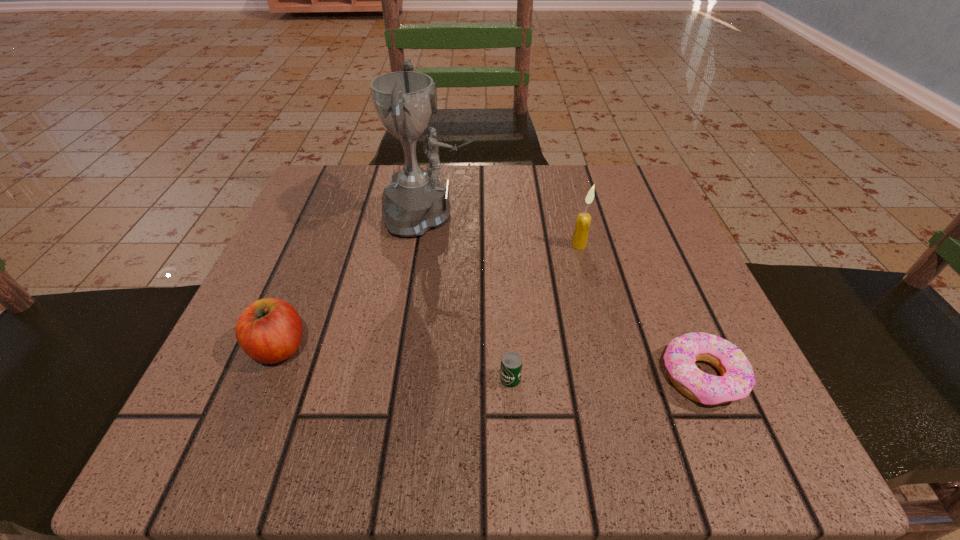
The height and width of the screenshot is (540, 960). What are the coordinates of `vacant space that satisfies the following two spatial constraints: 1. on the side with emblem of the award; 2. on the left side of the fourth shortest object` in the screenshot? It's located at (427, 245).